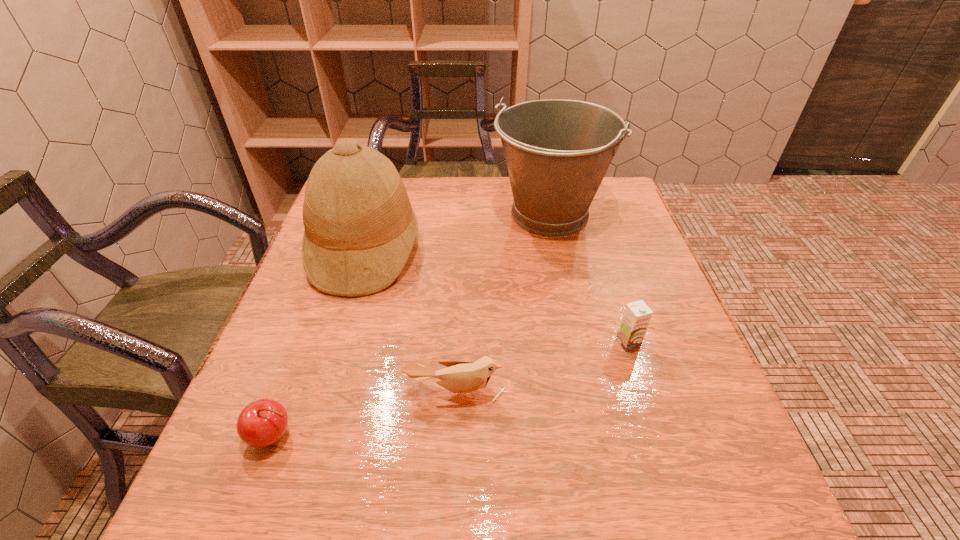
Where is `bucket located at the far edge`? Image resolution: width=960 pixels, height=540 pixels. bucket located at the far edge is located at coordinates (557, 152).

Where is `hat positioned at the far edge`? This screenshot has width=960, height=540. hat positioned at the far edge is located at coordinates (359, 227).

Find the location of a particular element. The image size is (960, 540). hat present at the left edge is located at coordinates (359, 227).

Where is `cherry that is at the left edge`? The height and width of the screenshot is (540, 960). cherry that is at the left edge is located at coordinates (263, 422).

In order to click on bucket that is positioned at the right edge in this screenshot , I will do `click(557, 152)`.

At what (x,y) coordinates should I click in order to perform the action: click on chocolate milk that is at the right edge. Please return your answer as a coordinate pair (x, y). This screenshot has height=540, width=960. Looking at the image, I should click on [637, 315].

You are a GUI agent. You are given a task and a screenshot of the screen. Output one action in this format:
    pyautogui.click(x=<x>, y=<y>)
    Task: Click on the object at the far left corner
    This screenshot has height=540, width=960.
    Given the screenshot: What is the action you would take?
    pyautogui.click(x=359, y=227)

Where is `object that is at the far right corner`? object that is at the far right corner is located at coordinates (557, 152).

In the image, there is a desktop. At what (x,y) coordinates should I click in order to perform the action: click on vacant space at the far edge. Please return your answer as a coordinate pair (x, y). The height and width of the screenshot is (540, 960). Looking at the image, I should click on (444, 190).

Where is `vacant space at the near edge of the desktop`? This screenshot has height=540, width=960. vacant space at the near edge of the desktop is located at coordinates (583, 525).